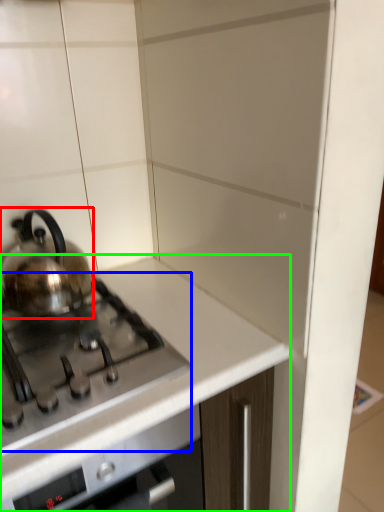
Question: Which object is positioned closest to kettle (highlighted by a red box)? Select from gas stove (highlighted by a blue box) and countertop (highlighted by a green box).

Choices:
 (A) gas stove
 (B) countertop

Answer: (A)